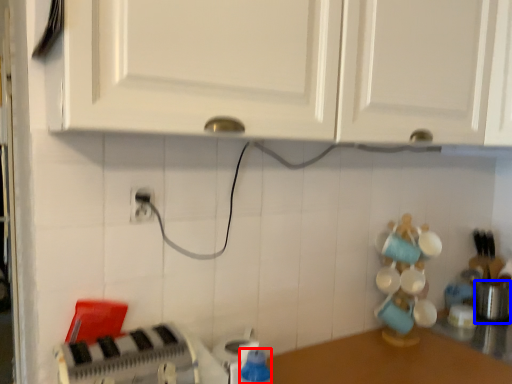
Question: Which object is further to the camera taking this photo, bottle (highlighted by a red box) or appliance (highlighted by a blue box)?

Choices:
 (A) bottle
 (B) appliance

Answer: (B)